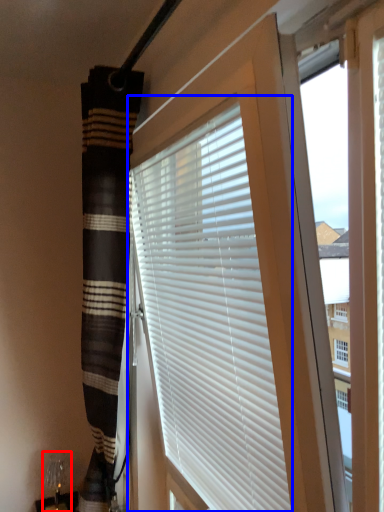
Question: Among these objects, which one is farthest to the camera, table lamp (highlighted by a red box) or window blind (highlighted by a blue box)?

Choices:
 (A) table lamp
 (B) window blind

Answer: (A)